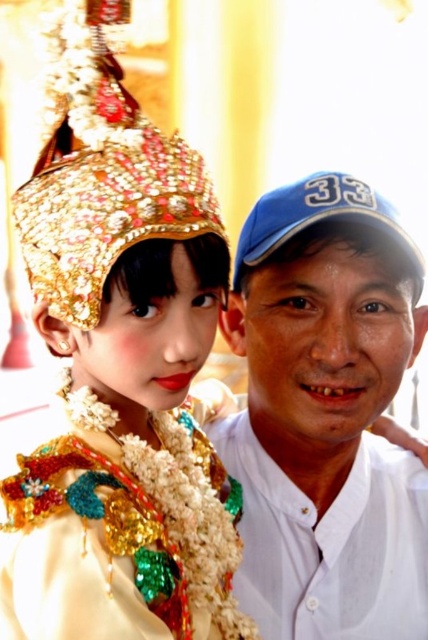
You are taking a photo of two people standing at the points mentioned. The person at point (79,412) is wearing a golden headdress. Do they appear closer to the camera compared to the person at point (297,218)?

Yes, the person at point (79,412) is in front of the person at point (297,218), so they appear closer to the camera.

You are standing at the point labeled point (92,596) and want to take a photo of the two people in the scene. The camera you have can focus on subjects within 2 meters. Will the camera be able to capture both individuals clearly?

The point labeled point (92,596) and the camera are 1.84 meters apart, so yes, the camera can capture both individuals clearly since the distance is within the 2 meters focus range.